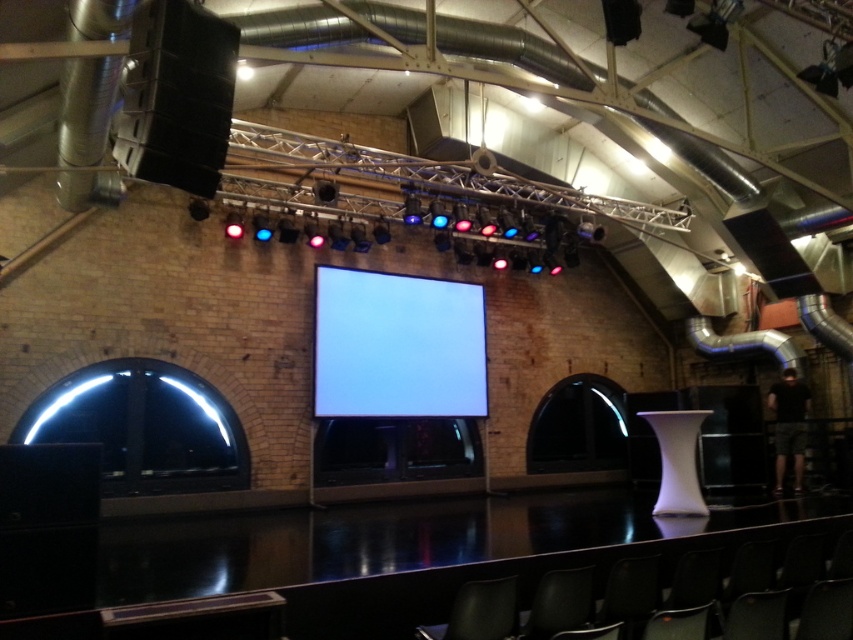
You are setting up for an event and need to place a large decorative item that requires knowing the relative sizes of objects in the scene. Which object is bigger between the white glossy projection screen at center and the matte black chair at lower center?

The white glossy projection screen at center is larger in size than the matte black chair at lower center, so the projection screen is bigger.

You are setting up for an event and want to place the matte black chair at lower center directly in front of the white glossy projection screen at center. Based on their sizes, will the chair fit entirely within the width of the screen?

The white glossy projection screen at center might be wider than matte black chair at lower center, so there is a possibility that the chair will fit within the screen width. However, since the exact dimensions are not provided, it is recommended to measure both to ensure proper placement.